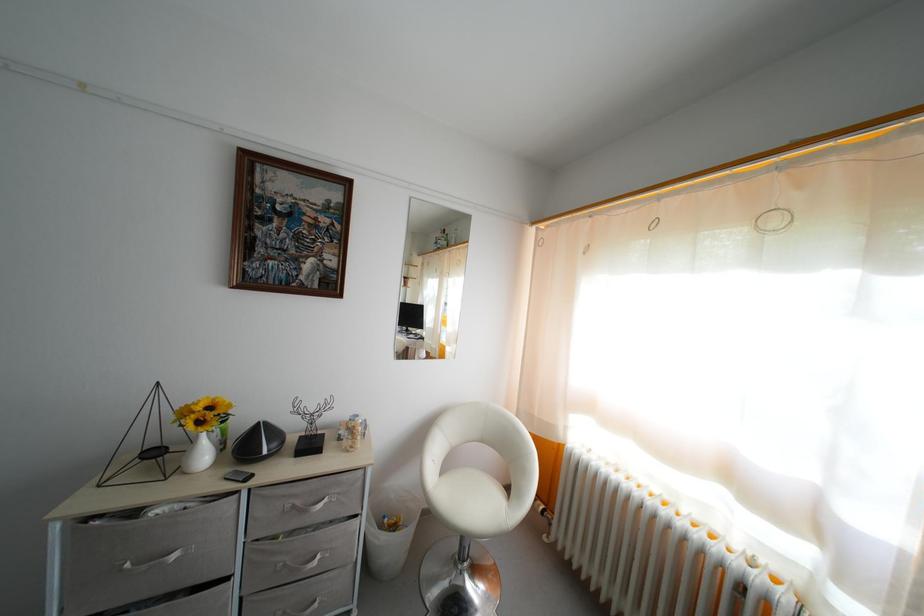
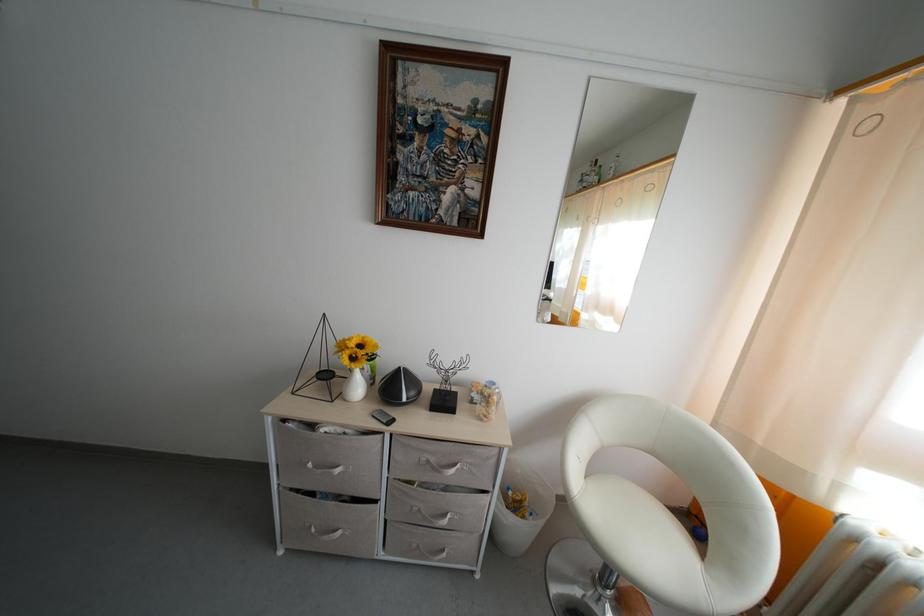
The point at (235, 476) is marked in the first image. Where is the corresponding point in the second image?

(382, 413)